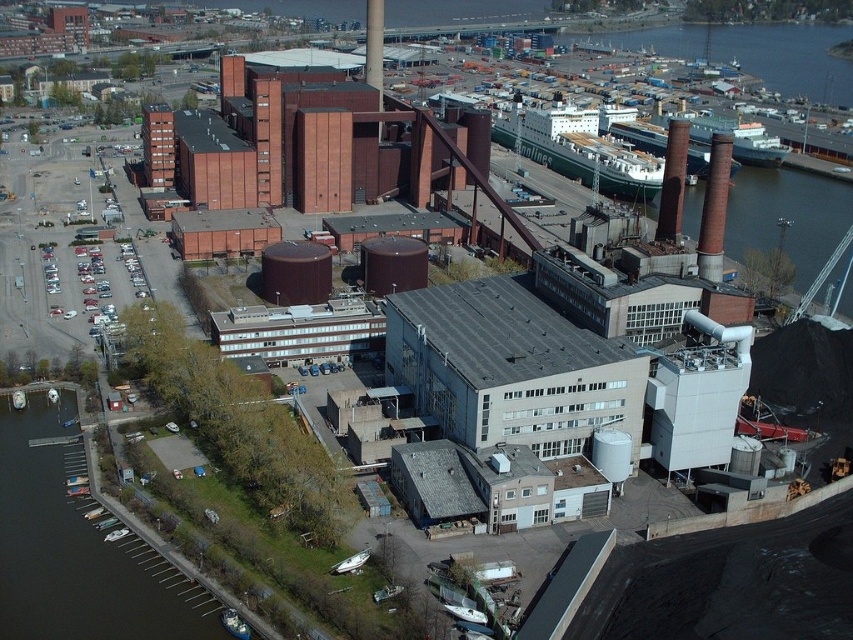
Question: Estimate the real-world distances between objects in this image. Which object is closer to the dark green water at lower left?

Choices:
 (A) smooth brick chimney at upper right
 (B) rustic brick chimney at upper right

Answer: (B)

Question: Which point is closer to the camera?

Choices:
 (A) rustic brick chimney at upper right
 (B) smooth brick chimney at upper right
 (C) dark green water at lower left

Answer: (C)

Question: Does dark green water at lower left lie behind smooth brick chimney at upper right?

Choices:
 (A) yes
 (B) no

Answer: (B)

Question: Considering the relative positions of dark green water at lower left and smooth brick chimney at upper right in the image provided, where is dark green water at lower left located with respect to smooth brick chimney at upper right?

Choices:
 (A) left
 (B) right

Answer: (A)

Question: Is the position of rustic brick chimney at upper right less distant than that of smooth brick chimney at upper right?

Choices:
 (A) yes
 (B) no

Answer: (A)

Question: Which is farther from the smooth brick chimney at upper right?

Choices:
 (A) dark green water at lower left
 (B) rustic brick chimney at upper right

Answer: (A)